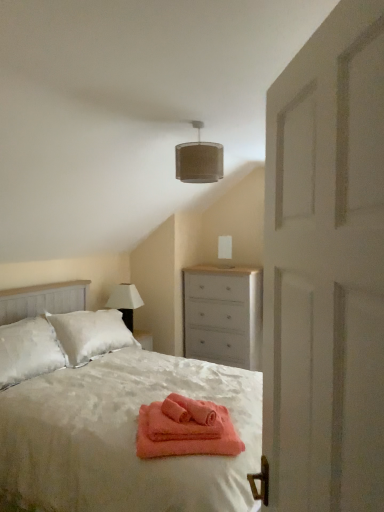
Question: Would you consider white painted wood chest of drawers at center to be distant from white wooden door at right?

Choices:
 (A) no
 (B) yes

Answer: (B)

Question: Is white painted wood chest of drawers at center aimed at white wooden door at right?

Choices:
 (A) yes
 (B) no

Answer: (B)

Question: Is white painted wood chest of drawers at center touching white wooden door at right?

Choices:
 (A) no
 (B) yes

Answer: (A)

Question: Can you confirm if white painted wood chest of drawers at center is smaller than white wooden door at right?

Choices:
 (A) no
 (B) yes

Answer: (A)

Question: Is white painted wood chest of drawers at center positioned beyond the bounds of white wooden door at right?

Choices:
 (A) yes
 (B) no

Answer: (A)

Question: In terms of width, does white wooden door at right look wider or thinner when compared to white fabric lampshade at upper left?

Choices:
 (A) wide
 (B) thin

Answer: (B)

Question: From a real-world perspective, is white wooden door at right physically located above or below white fabric lampshade at upper left?

Choices:
 (A) below
 (B) above

Answer: (B)

Question: Based on their sizes in the image, would you say white wooden door at right is bigger or smaller than white fabric lampshade at upper left?

Choices:
 (A) big
 (B) small

Answer: (A)

Question: Would you say white wooden door at right is inside or outside white fabric lampshade at upper left?

Choices:
 (A) inside
 (B) outside

Answer: (B)

Question: Choose the correct answer: Is white satin bed at center inside white painted wood chest of drawers at center or outside it?

Choices:
 (A) inside
 (B) outside

Answer: (B)

Question: From a real-world perspective, is white satin bed at center above or below white painted wood chest of drawers at center?

Choices:
 (A) above
 (B) below

Answer: (B)

Question: Is white satin bed at center bigger or smaller than white painted wood chest of drawers at center?

Choices:
 (A) small
 (B) big

Answer: (B)

Question: From their relative heights in the image, would you say white satin bed at center is taller or shorter than white painted wood chest of drawers at center?

Choices:
 (A) short
 (B) tall

Answer: (B)

Question: Is white painted wood chest of drawers at center taller or shorter than white wooden door at right?

Choices:
 (A) short
 (B) tall

Answer: (A)

Question: Relative to white wooden door at right, is white painted wood chest of drawers at center in front or behind?

Choices:
 (A) front
 (B) behind

Answer: (B)